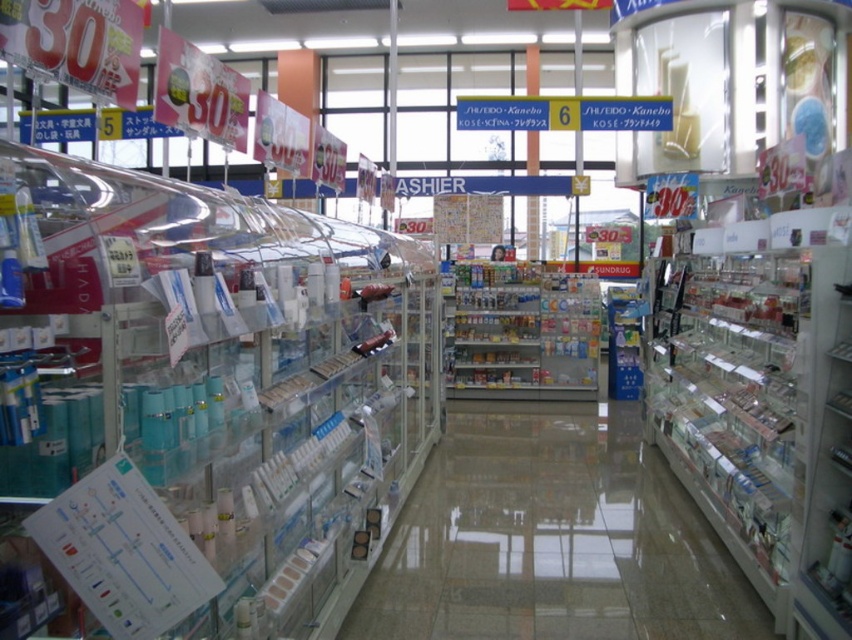
Can you confirm if clear plastic bottles at left is taller than transparent plastic shelves at center?

Correct, clear plastic bottles at left is much taller as transparent plastic shelves at center.

Is clear plastic bottles at left above transparent plastic shelves at center?

Indeed, clear plastic bottles at left is positioned over transparent plastic shelves at center.

I want to click on clear plastic bottles at left, so click(199, 403).

Where is `clear plastic bottles at left`? clear plastic bottles at left is located at coordinates (199, 403).